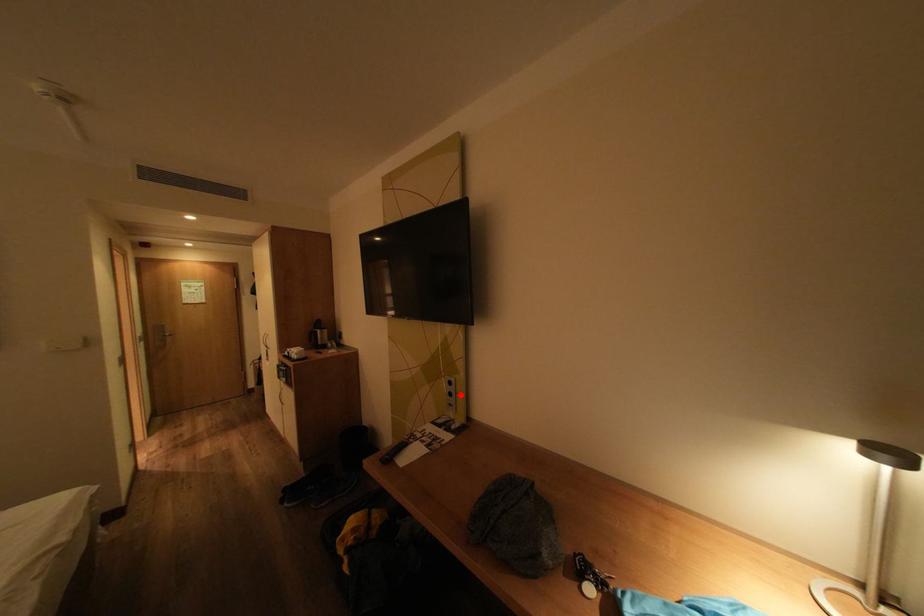
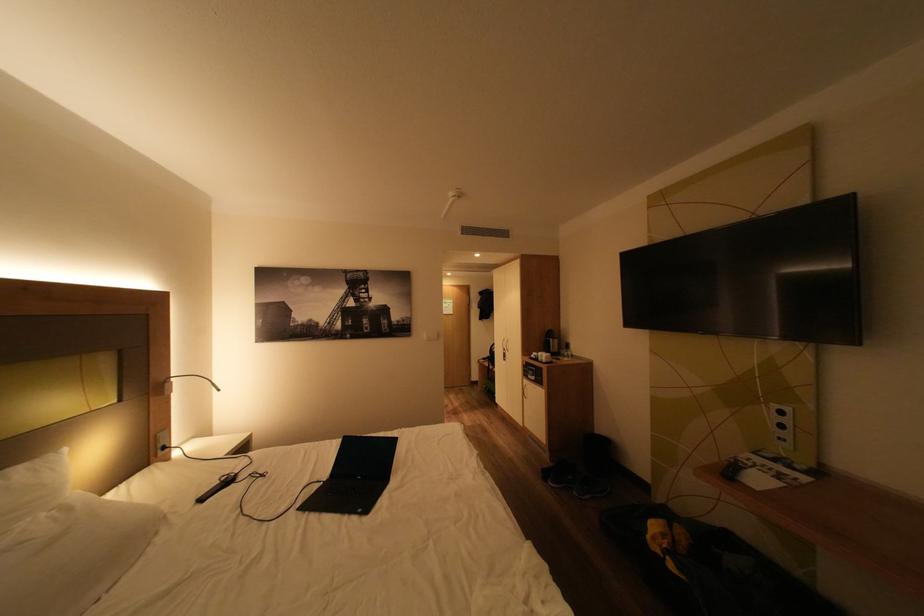
Find the pixel in the second image that matches the highlighted location in the first image.

(793, 427)